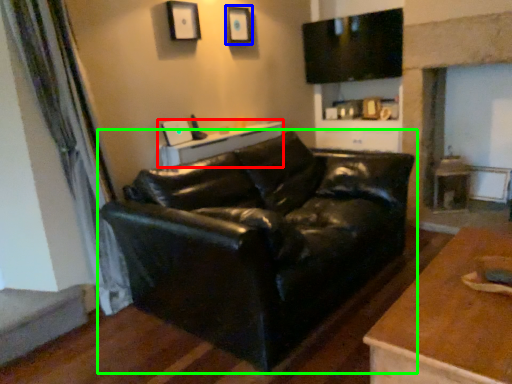
Question: Considering the real-world distances, which object is closest to table (highlighted by a red box)? picture frame (highlighted by a blue box) or studio couch (highlighted by a green box).

Choices:
 (A) picture frame
 (B) studio couch

Answer: (B)